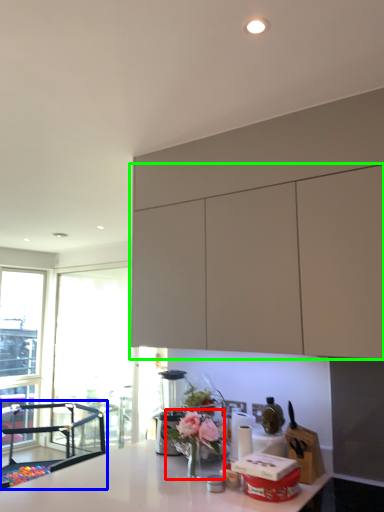
Question: Considering the real-world distances, which object is farthest from floral arrangement (highlighted by a red box)? chair (highlighted by a blue box) or cabinetry (highlighted by a green box)?

Choices:
 (A) chair
 (B) cabinetry

Answer: (A)